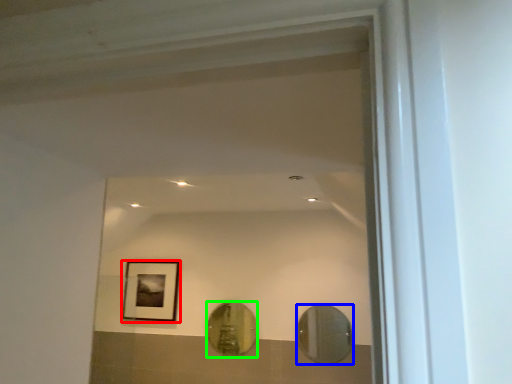
Question: Which object is the closest to the picture frame (highlighted by a red box)? Choose among these: mirror (highlighted by a blue box) or mirror (highlighted by a green box).

Choices:
 (A) mirror
 (B) mirror

Answer: (B)